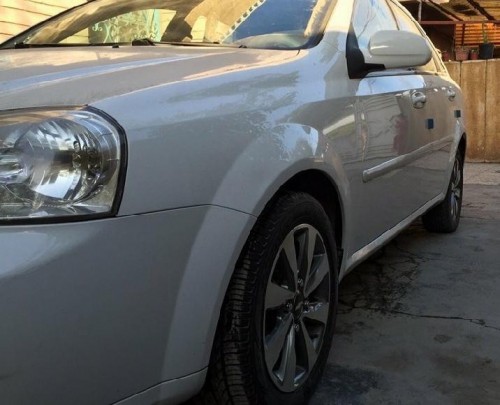
What are the coordinates of `hood` in the screenshot? It's located at (38, 55).